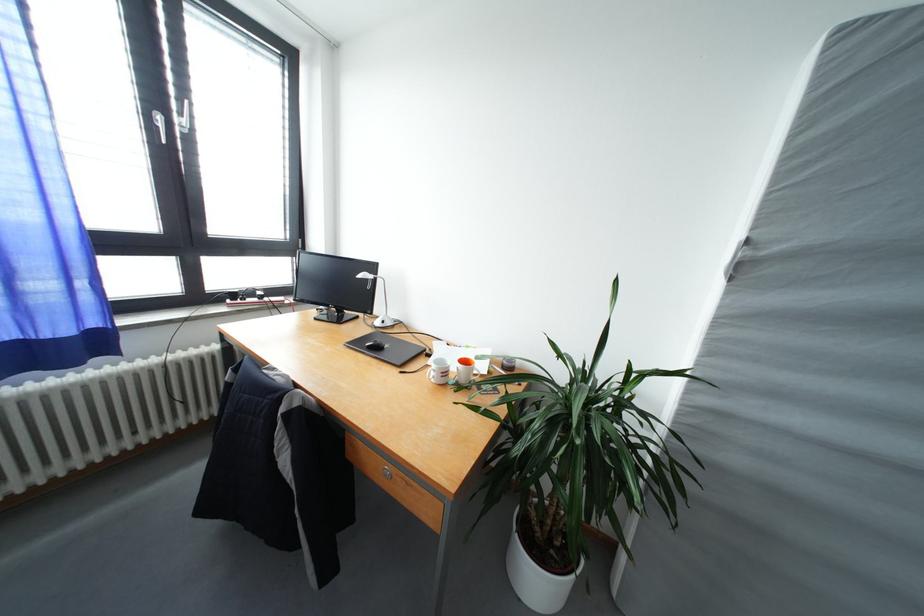
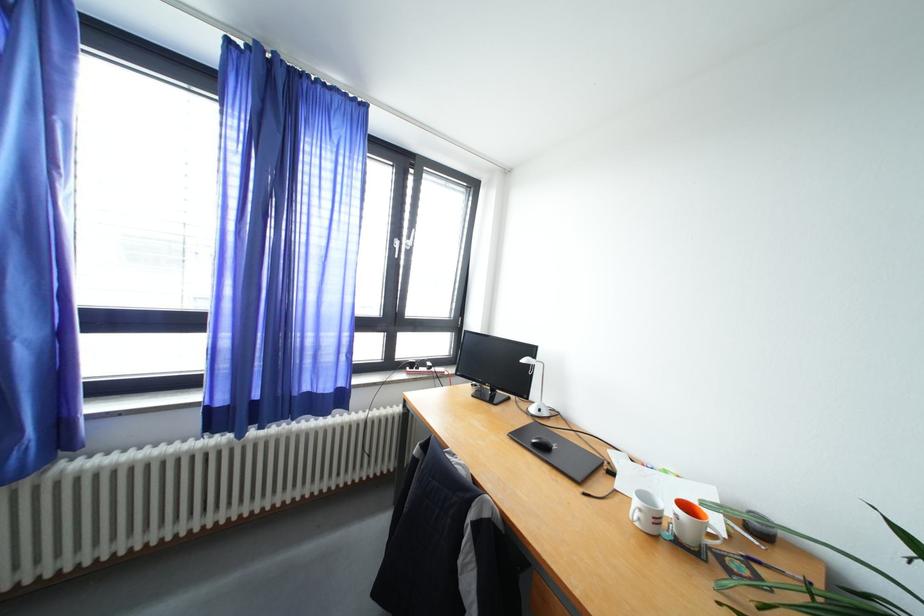
The point at [165,122] is marked in the first image. Where is the corresponding point in the second image?

(404, 246)